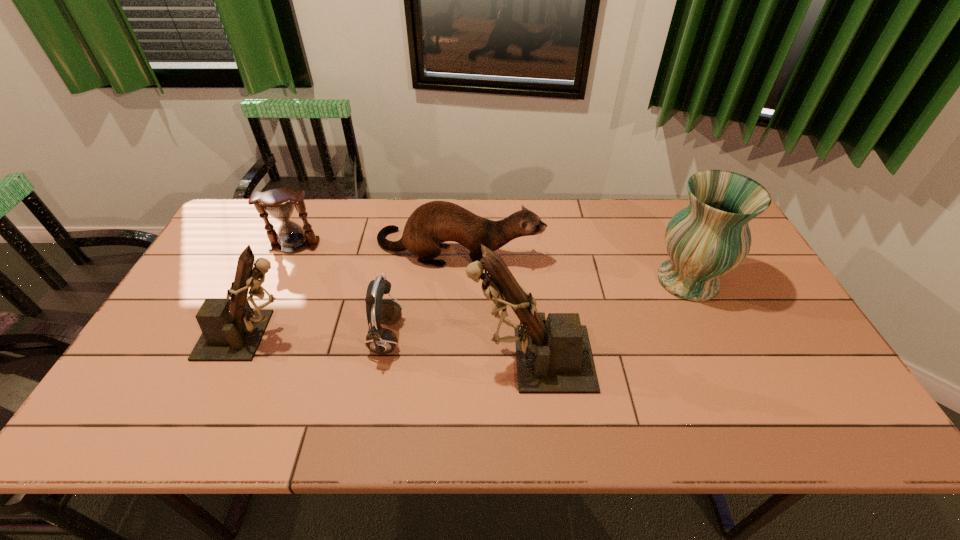
Where is `the shorter figurine`? Image resolution: width=960 pixels, height=540 pixels. the shorter figurine is located at coordinates (231, 330).

This screenshot has height=540, width=960. I want to click on the right figurine, so click(554, 355).

At what (x,y) coordinates should I click in order to perform the action: click on the tallest object. Please return your answer as a coordinate pair (x, y). Looking at the image, I should click on (554, 355).

Where is `the rightmost object`? The width and height of the screenshot is (960, 540). the rightmost object is located at coordinates (710, 237).

The height and width of the screenshot is (540, 960). I want to click on hourglass, so click(x=279, y=203).

You are a GUI agent. You are given a task and a screenshot of the screen. Output one action in this format:
    pyautogui.click(x=<x>, y=<y>)
    Task: Click on the ferret
    
    Given the screenshot: What is the action you would take?
    pyautogui.click(x=431, y=224)

In order to click on earphone in this screenshot , I will do `click(379, 340)`.

Locate an element on the screen. The width and height of the screenshot is (960, 540). free location located 0.160m on the front-facing side of the left figurine is located at coordinates pos(363,335).

This screenshot has width=960, height=540. I want to click on vacant space located on the front-facing side of the right figurine, so click(392, 359).

Locate an element on the screen. This screenshot has height=540, width=960. vacant space located 0.330m on the front-facing side of the right figurine is located at coordinates (336, 359).